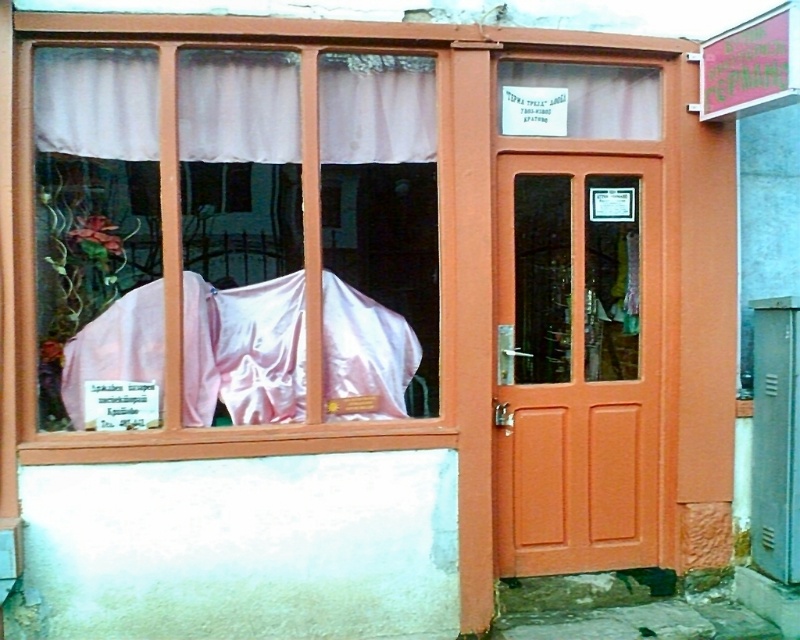
You are standing in front of a building with a warm orange facade. You notice a white sheer curtain at upper left. If you want to take a photo of the building without the curtain in the frame, how far back should you move from the current position?

You need to move back to ensure the camera is more than 3.77 meters away from the white sheer curtain at upper left to exclude it from the frame.

You are standing outside the building and see the point at coordinates (234, 237). What object is this point located on?

The point at coordinates (234, 237) is located on the pink satin cloth at left.